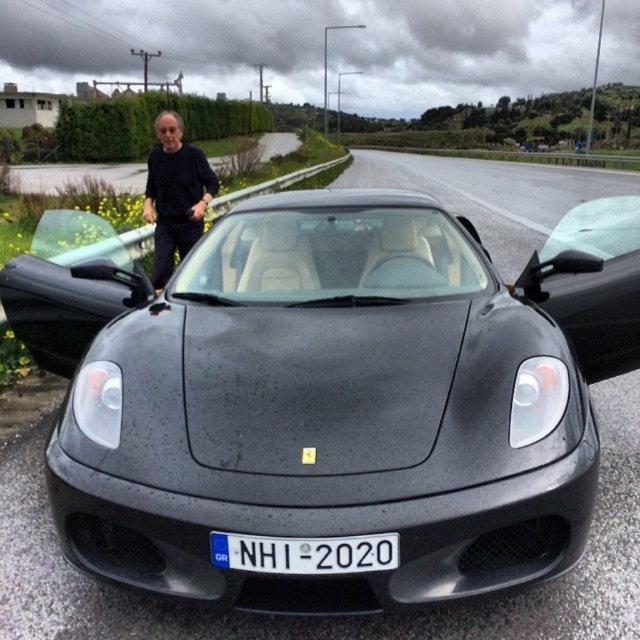
Question: Which of these objects is positioned farthest from the glossy black sports car at center?

Choices:
 (A) black matte shirt at left
 (B) white plastic license plate at center

Answer: (A)

Question: Which object appears farthest from the camera in this image?

Choices:
 (A) black matte shirt at left
 (B) white plastic license plate at center

Answer: (A)

Question: Can you confirm if black matte shirt at left is wider than white plastic license plate at center?

Choices:
 (A) no
 (B) yes

Answer: (B)

Question: Can you confirm if black matte shirt at left is positioned to the right of white plastic license plate at center?

Choices:
 (A) yes
 (B) no

Answer: (B)

Question: Is black matte shirt at left above white plastic license plate at center?

Choices:
 (A) yes
 (B) no

Answer: (A)

Question: Which point is farther to the camera?

Choices:
 (A) glossy black sports car at center
 (B) black matte shirt at left
 (C) white plastic license plate at center

Answer: (B)